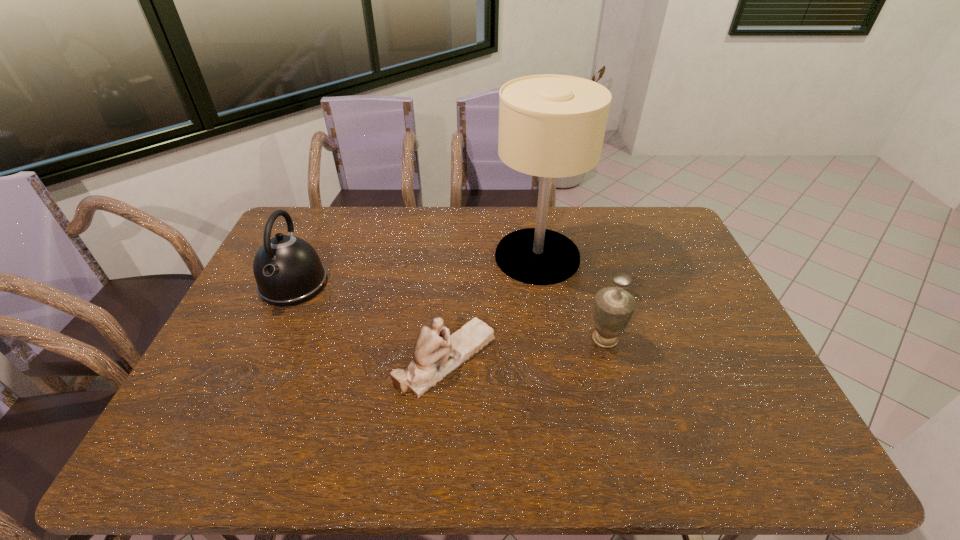
Find the location of a particular element. Image resolution: width=960 pixels, height=540 pixels. the tallest object is located at coordinates (552, 126).

This screenshot has width=960, height=540. In order to click on the leftmost object in this screenshot , I will do `click(288, 271)`.

Locate an element on the screen. The image size is (960, 540). urn is located at coordinates (613, 308).

Where is `figurine`? figurine is located at coordinates (437, 354).

Identify the location of the third object from right to left. The width and height of the screenshot is (960, 540). (437, 354).

Image resolution: width=960 pixels, height=540 pixels. Find the location of `vacant region located on the right of the tallest object`. vacant region located on the right of the tallest object is located at coordinates (682, 256).

This screenshot has width=960, height=540. I want to click on free space located on the spout of the leftmost object, so click(x=274, y=328).

You are a GUI agent. You are given a task and a screenshot of the screen. Output one action in this format:
    pyautogui.click(x=<x>, y=<y>)
    Task: Click on the vacant space situated on the left of the urn
    
    Given the screenshot: What is the action you would take?
    pyautogui.click(x=547, y=339)

You are a GUI agent. You are given a task and a screenshot of the screen. Output one action in this format:
    pyautogui.click(x=<x>, y=<y>)
    Task: Click on the free spot located 0.060m on the front-facing side of the second object from left to right
    The width and height of the screenshot is (960, 540).
    Given the screenshot: What is the action you would take?
    pyautogui.click(x=518, y=358)

You are a GUI agent. You are given a task and a screenshot of the screen. Output one action in this format:
    pyautogui.click(x=<x>, y=<y>)
    Task: Click on the object that is at the far edge
    The height and width of the screenshot is (540, 960).
    Given the screenshot: What is the action you would take?
    pyautogui.click(x=552, y=126)